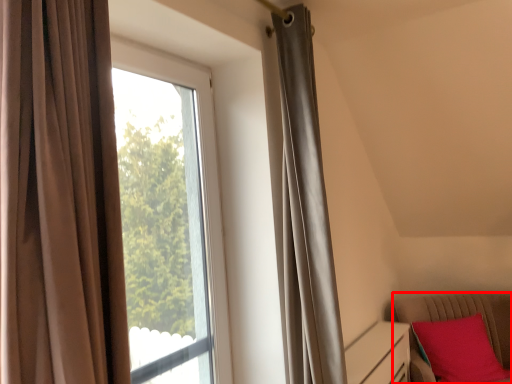
Question: From the image's perspective, what is the correct spatial positioning of furniture (annotated by the red box) in reference to window?

Choices:
 (A) above
 (B) below

Answer: (B)